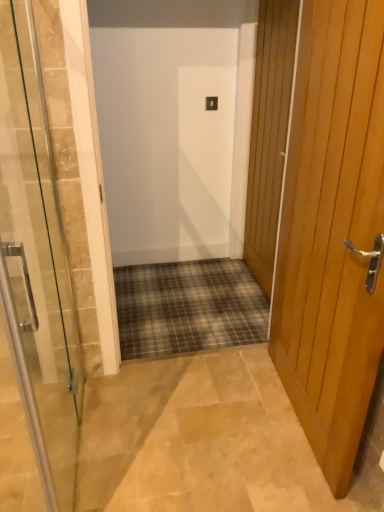
Question: From a real-world perspective, is wooden door at right, positioned as the first door in right-to-left order, positioned above or below clear glass door at center, acting as the first door starting from the left?

Choices:
 (A) below
 (B) above

Answer: (B)

Question: From the image's perspective, relative to clear glass door at center, acting as the first door starting from the left, is wooden door at right, which is the 3th door from left to right, above or below?

Choices:
 (A) above
 (B) below

Answer: (A)

Question: Considering the real-world distances, which object is closest to the clear glass door at center, the third door in the right-to-left sequence?

Choices:
 (A) light brown wooden door at right, which appears as the second door when viewed from the left
 (B) wooden door at right, which is the 3th door from left to right

Answer: (A)

Question: Considering the real-world distances, which object is closest to the light brown wooden door at right, the 2th door positioned from the right?

Choices:
 (A) clear glass door at center, acting as the first door starting from the left
 (B) wooden door at right, which is the 3th door from left to right

Answer: (B)